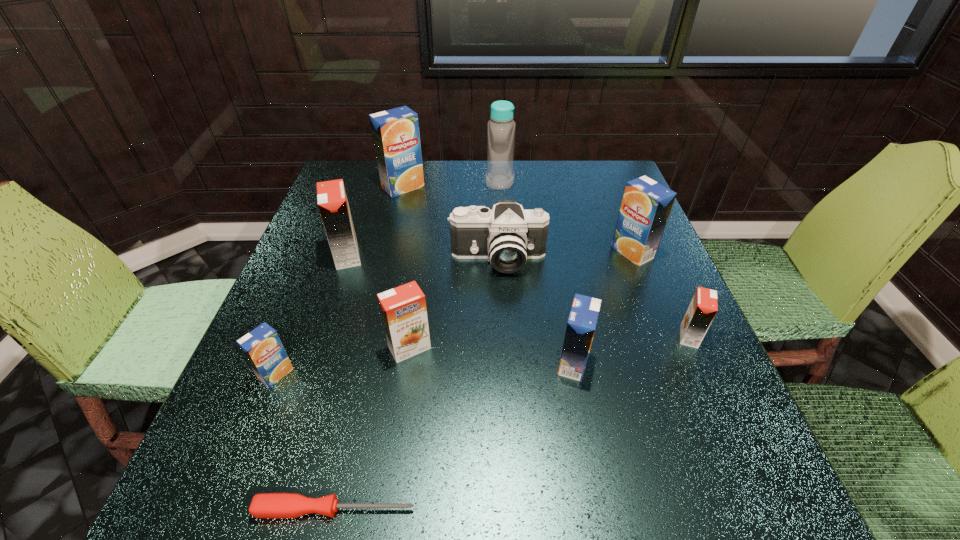
Identify the location of blue orange_juice that is the fourth closest to the farthest orange orange juice. This screenshot has width=960, height=540. (646, 205).

I want to click on orange orange juice that can be found as the second closest to the blue bottle, so click(403, 309).

You are a GUI agent. You are given a task and a screenshot of the screen. Output one action in this format:
    pyautogui.click(x=<x>, y=<y>)
    Task: Click on the second closest orange orange juice to the blue bottle
    This screenshot has width=960, height=540.
    Given the screenshot: What is the action you would take?
    403,309

At what (x,y) coordinates should I click in order to perform the action: click on vacant position in the image that satisfies the following two spatial constraints: 1. on the front side of the bottle; 2. on the right side of the third orange_juice from right to left. Please return your answer as a coordinate pair (x, y). The width and height of the screenshot is (960, 540). Looking at the image, I should click on (511, 363).

I want to click on vacant area in the image that satisfies the following two spatial constraints: 1. on the front side of the third biggest blue orange_juice; 2. on the left side of the bottle, so click(511, 363).

Locate an element on the screen. The width and height of the screenshot is (960, 540). free space that satisfies the following two spatial constraints: 1. on the back side of the second orange orange juice from left to right; 2. on the left side of the rightmost blue orange_juice is located at coordinates (423, 252).

Locate an element on the screen. This screenshot has width=960, height=540. vacant area that satisfies the following two spatial constraints: 1. on the front side of the second smallest blue orange_juice; 2. on the left side of the bottle is located at coordinates (511, 363).

The width and height of the screenshot is (960, 540). I want to click on free space that satisfies the following two spatial constraints: 1. on the back side of the second orange orange juice from right to left; 2. on the right side of the bottle, so click(x=434, y=181).